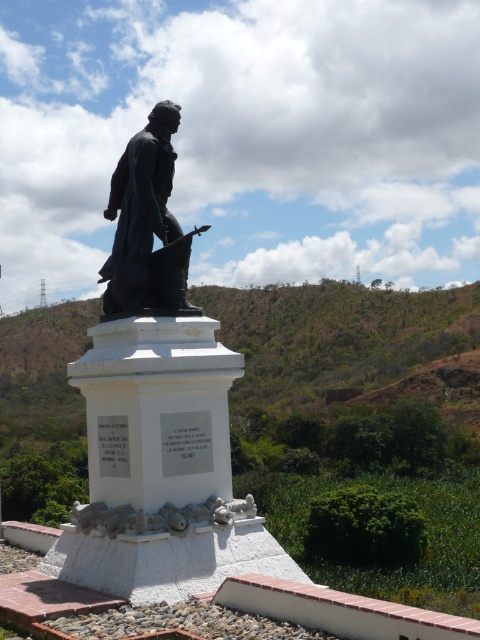
Question: Among these objects, which one is nearest to the camera?

Choices:
 (A) green leafy hillside at center
 (B) bronze statue at center
 (C) black polished statue at center

Answer: (C)

Question: Does green leafy hillside at center have a greater width compared to bronze statue at center?

Choices:
 (A) no
 (B) yes

Answer: (B)

Question: In this image, where is black polished statue at center located relative to green leafy hillside at center?

Choices:
 (A) below
 (B) above

Answer: (A)

Question: Estimate the real-world distances between objects in this image. Which object is closer to the black polished statue at center?

Choices:
 (A) bronze statue at center
 (B) green leafy hillside at center

Answer: (A)

Question: Which object is the closest to the green leafy hillside at center?

Choices:
 (A) black polished statue at center
 (B) bronze statue at center

Answer: (A)

Question: Is the position of black polished statue at center less distant than that of bronze statue at center?

Choices:
 (A) no
 (B) yes

Answer: (B)